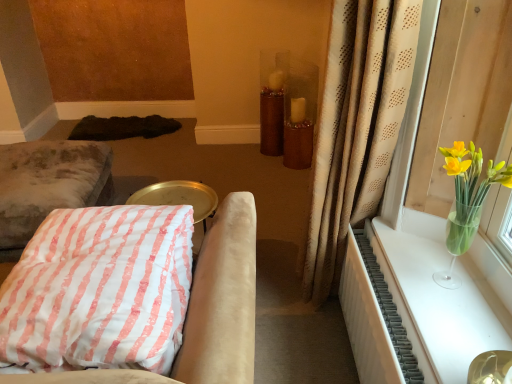
Question: From a real-world perspective, is translucent glass vase at upper right over brown glittery vase at center?

Choices:
 (A) yes
 (B) no

Answer: (A)

Question: From a real-world perspective, is translucent glass vase at upper right positioned under brown glittery vase at center based on gravity?

Choices:
 (A) yes
 (B) no

Answer: (B)

Question: Can you confirm if translucent glass vase at upper right is smaller than brown glittery vase at center?

Choices:
 (A) no
 (B) yes

Answer: (B)

Question: Does translucent glass vase at upper right come in front of brown glittery vase at center?

Choices:
 (A) yes
 (B) no

Answer: (A)

Question: Is translucent glass vase at upper right to the left of brown glittery vase at center from the viewer's perspective?

Choices:
 (A) yes
 (B) no

Answer: (B)

Question: Could brown glittery vase at center be considered to be inside translucent glass vase at upper right?

Choices:
 (A) yes
 (B) no

Answer: (B)

Question: Is pink striped fabric cushion at lower left, which is counted as the second furniture, starting from the back, surrounding white textured radiator at right?

Choices:
 (A) yes
 (B) no

Answer: (B)

Question: Is pink striped fabric cushion at lower left, which is counted as the second furniture, starting from the back, facing away from white textured radiator at right?

Choices:
 (A) no
 (B) yes

Answer: (B)

Question: From a real-world perspective, is pink striped fabric cushion at lower left, the first furniture when ordered from right to left, located beneath white textured radiator at right?

Choices:
 (A) no
 (B) yes

Answer: (A)

Question: Is pink striped fabric cushion at lower left, which is the second furniture from left to right, closer to camera compared to white textured radiator at right?

Choices:
 (A) no
 (B) yes

Answer: (B)

Question: Could you tell me if pink striped fabric cushion at lower left, the first furniture in the front-to-back sequence, is turned towards white textured radiator at right?

Choices:
 (A) yes
 (B) no

Answer: (B)

Question: Is pink striped fabric cushion at lower left, the first furniture in the front-to-back sequence, to the left of white textured radiator at right from the viewer's perspective?

Choices:
 (A) no
 (B) yes

Answer: (B)

Question: Could you tell me if white textured radiator at right is turned towards velvet cushion at left, the second furniture when ordered from right to left?

Choices:
 (A) yes
 (B) no

Answer: (B)